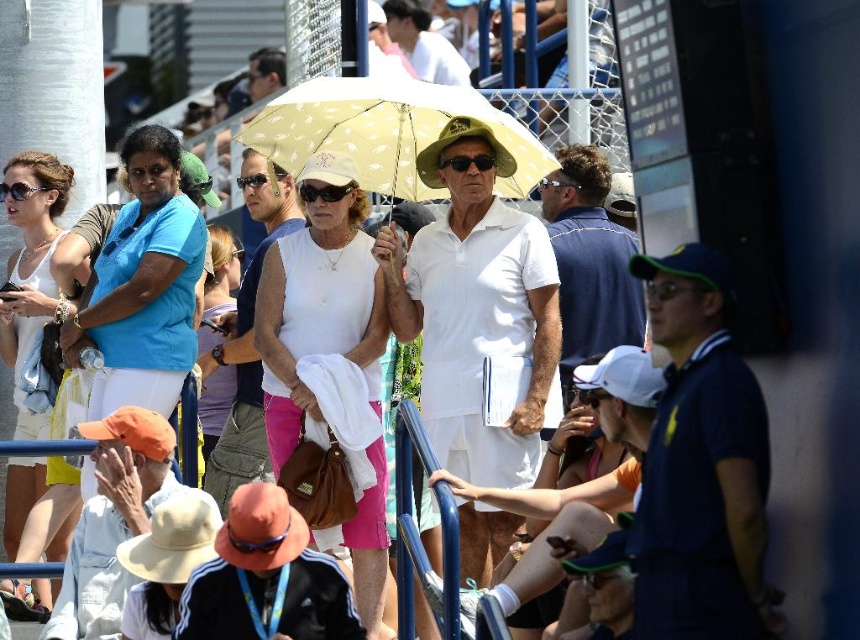
You are a photographer at the tennis match and want to capture a clear shot of both the white matte tank top at center and the black plastic sunglasses at center. Which object should you focus on first if you want to ensure both are in focus?

The white matte tank top at center is taller than the black plastic sunglasses at center. To ensure both are in focus, you should focus on the white matte tank top at center first since it is larger and might require more precise focusing, then adjust for the smaller black plastic sunglasses at center.

You are standing at the point with coordinates point (468, 164) and want to walk towards the point (306, 388). Which direction should you move?

You should move forward because point (306, 388) is in front of point (468, 164).

You are a photographer trying to capture a candid shot of the two people at the center of the tennis match scene. You notice both the white matte tank top at center and the white fabric shirt at center. Which clothing item has a greater width when viewed from your camera position?

The white matte tank top at center has a greater width than the white fabric shirt at center.